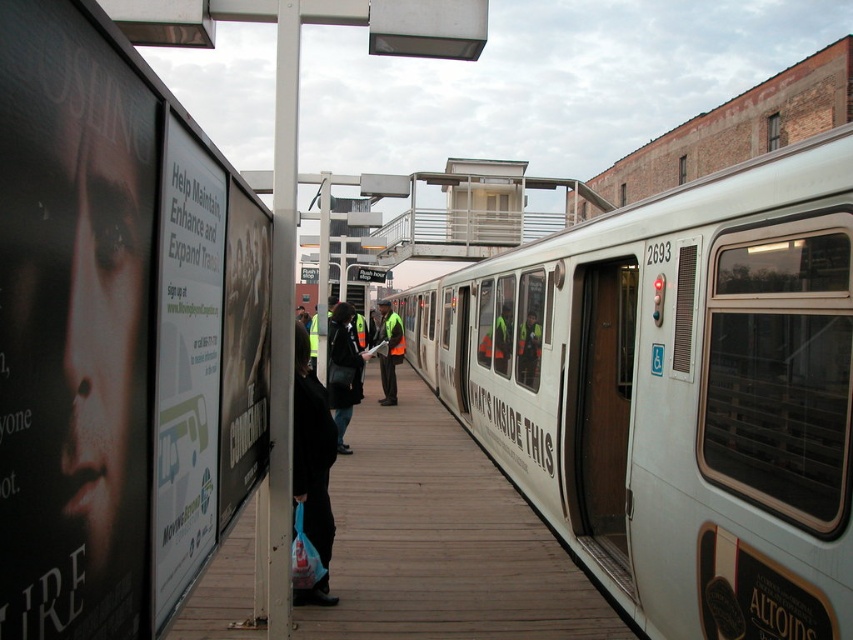
In the scene shown: Does white paper poster at left have a larger size compared to black fabric bag at lower center?

Actually, white paper poster at left might be smaller than black fabric bag at lower center.

Can you confirm if white paper poster at left is smaller than black fabric bag at lower center?

Yes, white paper poster at left is smaller than black fabric bag at lower center.

Where is `white paper poster at left`? The width and height of the screenshot is (853, 640). white paper poster at left is located at coordinates (186, 368).

Where is `white paper poster at left`? Image resolution: width=853 pixels, height=640 pixels. white paper poster at left is located at coordinates (186, 368).

Which is above, white metallic train at center or matte black jacket at center?

white metallic train at center

In the scene shown: Which is more to the left, white metallic train at center or matte black jacket at center?

From the viewer's perspective, matte black jacket at center appears more on the left side.

You are a GUI agent. You are given a task and a screenshot of the screen. Output one action in this format:
    pyautogui.click(x=<x>, y=<y>)
    Task: Click on the white metallic train at center
    The image size is (853, 640).
    Given the screenshot: What is the action you would take?
    click(677, 392)

Does point (339, 451) come behind point (381, 305)?

No, it is not.

Consider the image. Is matte black jacket at center to the right of reflective yellow vest at center from the viewer's perspective?

In fact, matte black jacket at center is to the left of reflective yellow vest at center.

Who is more forward, (347, 448) or (392, 356)?

Point (347, 448)

Locate an element on the screen. matte black jacket at center is located at coordinates [343, 369].